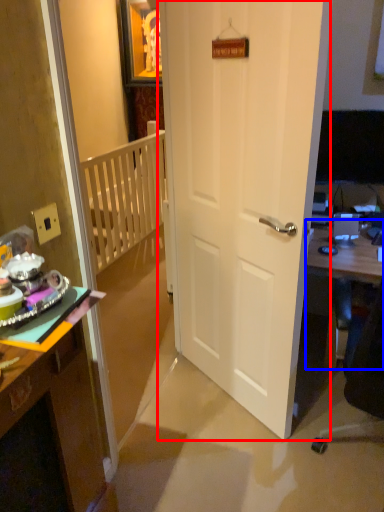
Question: Which object is closer to the camera taking this photo, door (highlighted by a red box) or table (highlighted by a blue box)?

Choices:
 (A) door
 (B) table

Answer: (A)